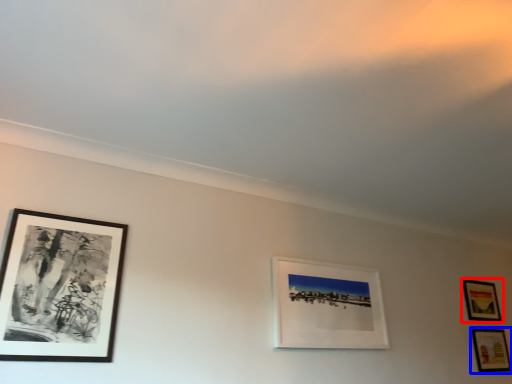
Question: Which of the following is the farthest to the observer, picture frame (highlighted by a red box) or picture frame (highlighted by a blue box)?

Choices:
 (A) picture frame
 (B) picture frame

Answer: (A)